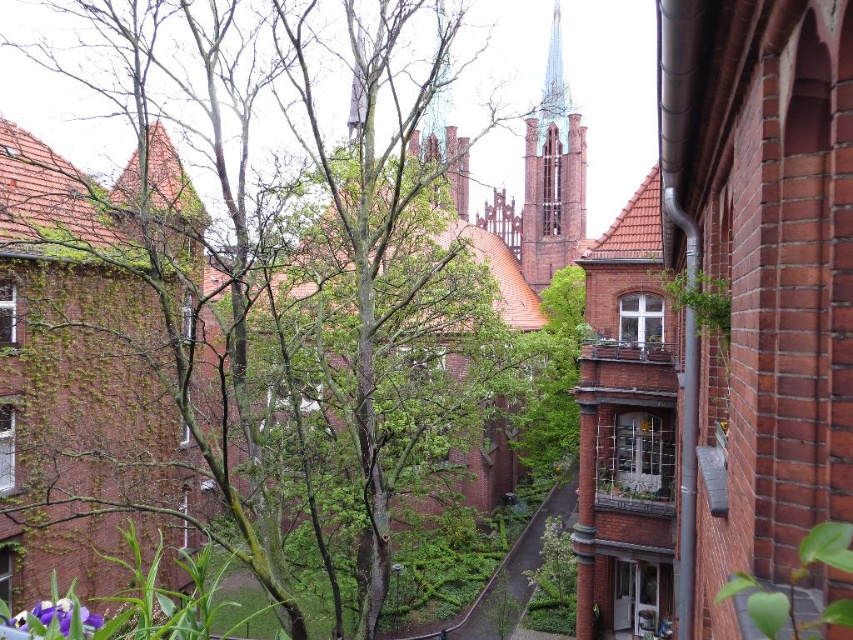
Looking at this image, who is more distant from viewer, (469, 616) or (22, 625)?

Positioned behind is point (469, 616).

Can you confirm if green leafy alley at center is taller than purple matte flower at lower left?

Correct, green leafy alley at center is much taller as purple matte flower at lower left.

Between point (566, 512) and point (86, 634), which one is positioned in front?

Point (86, 634)

Identify the location of green leafy alley at center. This screenshot has width=853, height=640. (514, 570).

Is point (369, 314) behind point (543, 172)?

No.

Find the location of a particular element. The height and width of the screenshot is (640, 853). green leafy tree at center is located at coordinates (254, 296).

Who is shorter, brown brick tower at center or purple matte flower at lower left?

With less height is purple matte flower at lower left.

Measure the distance from brown brick tower at center to purple matte flower at lower left.

brown brick tower at center is 116.84 meters away from purple matte flower at lower left.

Identify the location of brown brick tower at center. (552, 173).